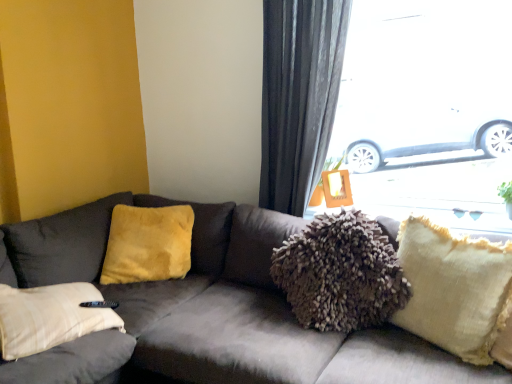
Identify the location of vacant point above fuzzy fabric pillow at upper right (from a real-world perspective). (412, 210).